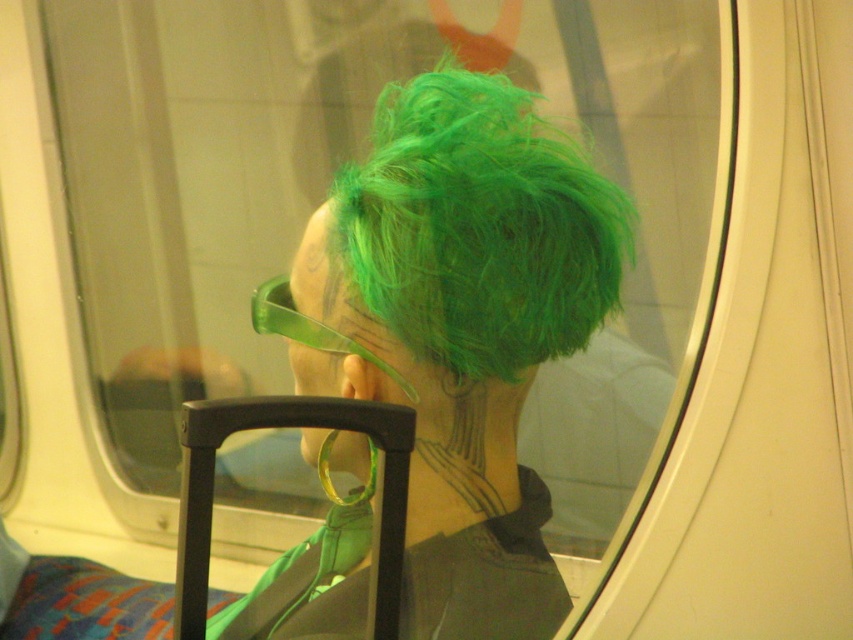
Question: Is green matte wig at upper center above green fluffy hair at center?

Choices:
 (A) no
 (B) yes

Answer: (A)

Question: Which object is closer to the camera taking this photo?

Choices:
 (A) green matte wig at upper center
 (B) green fluffy hair at center

Answer: (A)

Question: Which point is farther from the camera taking this photo?

Choices:
 (A) (355, 198)
 (B) (442, 444)

Answer: (B)

Question: Which object is closer to the camera taking this photo?

Choices:
 (A) green fluffy hair at center
 (B) green matte wig at upper center

Answer: (B)

Question: Can you confirm if green matte wig at upper center is positioned below green fluffy hair at center?

Choices:
 (A) yes
 (B) no

Answer: (A)

Question: Is green matte wig at upper center positioned at the back of green fluffy hair at center?

Choices:
 (A) no
 (B) yes

Answer: (A)